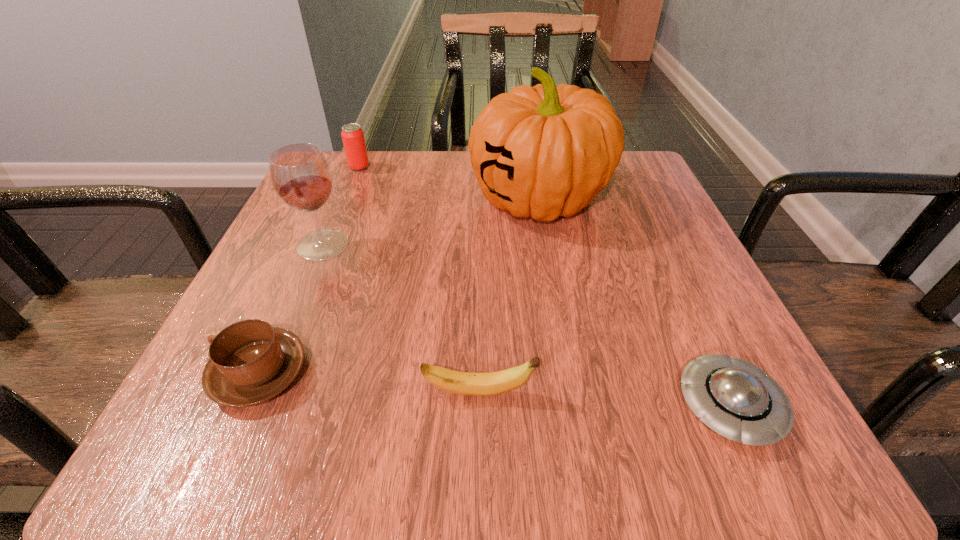
This screenshot has height=540, width=960. Identify the location of cappuccino located at the left edge. (250, 362).

The width and height of the screenshot is (960, 540). What are the coordinates of `pumpkin located in the right edge section of the desktop` in the screenshot? It's located at (544, 151).

The width and height of the screenshot is (960, 540). What are the coordinates of `saucer present at the right edge` in the screenshot? It's located at (738, 400).

You are a GUI agent. You are given a task and a screenshot of the screen. Output one action in this format:
    pyautogui.click(x=<x>, y=<y>)
    Task: Click on the object present at the far left corner
    The height and width of the screenshot is (540, 960).
    Given the screenshot: What is the action you would take?
    pyautogui.click(x=353, y=139)

The height and width of the screenshot is (540, 960). Find the location of `object present at the near left corner`. object present at the near left corner is located at coordinates pyautogui.click(x=250, y=362).

At what (x,y) coordinates should I click in order to perform the action: click on object situated at the far right corner. Please return your answer as a coordinate pair (x, y). Looking at the image, I should click on (544, 151).

Where is `object located at the near right corner`? This screenshot has height=540, width=960. object located at the near right corner is located at coordinates (738, 400).

Locate an element on the screen. The image size is (960, 540). vacant region at the far edge is located at coordinates [444, 190].

Image resolution: width=960 pixels, height=540 pixels. In the image, there is a desktop. Identify the location of free space at the near edge. (591, 429).

In the image, there is a desktop. Where is `free space at the left edge`? This screenshot has height=540, width=960. free space at the left edge is located at coordinates (279, 316).